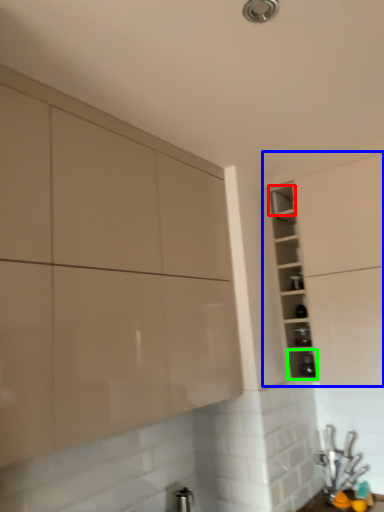
Question: Which is farther away from shelf (highlighted by a red box)? cabinetry (highlighted by a blue box) or shelf (highlighted by a green box)?

Choices:
 (A) cabinetry
 (B) shelf

Answer: (B)